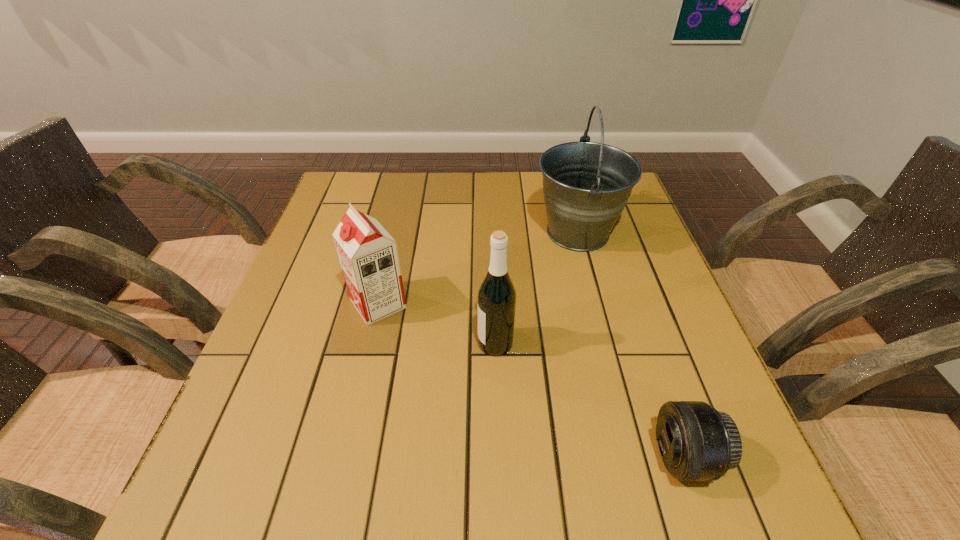
In order to click on the tallest object in this screenshot , I will do `click(586, 185)`.

Image resolution: width=960 pixels, height=540 pixels. I want to click on the farthest object, so click(586, 185).

Locate an element on the screen. the third object from right to left is located at coordinates (496, 298).

You are a GUI agent. You are given a task and a screenshot of the screen. Output one action in this format:
    pyautogui.click(x=<x>, y=<y>)
    Task: Click on the wine bottle
    The height and width of the screenshot is (540, 960).
    Given the screenshot: What is the action you would take?
    pyautogui.click(x=496, y=298)

Identify the location of the leftmost object. The width and height of the screenshot is (960, 540). (368, 255).

Identify the location of soya milk. (368, 255).

Image resolution: width=960 pixels, height=540 pixels. Find the location of `telephoto lens`. telephoto lens is located at coordinates (697, 443).

Locate an element on the screen. This screenshot has width=960, height=540. the nearest object is located at coordinates (697, 443).

This screenshot has width=960, height=540. In order to click on vacant area situated on the front of the farthest object in this screenshot , I will do `click(594, 294)`.

Where is `free point located 0.340m on the label of the wine bottle`? The height and width of the screenshot is (540, 960). free point located 0.340m on the label of the wine bottle is located at coordinates (313, 343).